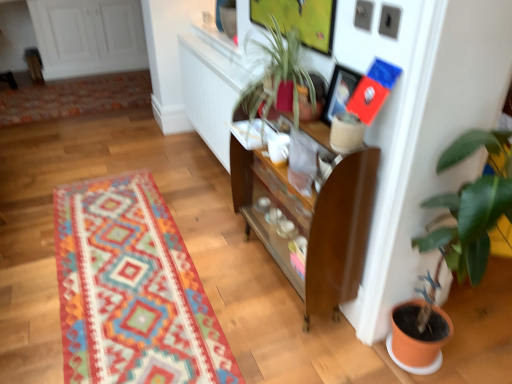
Question: Is white glossy coffee cup at center positioned beyond the bounds of multicolored woven rug at upper left, placed as the first mat when sorted from back to front?

Choices:
 (A) yes
 (B) no

Answer: (A)

Question: From a real-world perspective, is white glossy coffee cup at center located beneath multicolored woven rug at upper left, which is the 1th mat in top-to-bottom order?

Choices:
 (A) no
 (B) yes

Answer: (A)

Question: Is white glossy coffee cup at center positioned in front of multicolored woven rug at upper left, the 2th mat in the front-to-back sequence?

Choices:
 (A) no
 (B) yes

Answer: (B)

Question: Does white glossy coffee cup at center have a larger size compared to multicolored woven rug at upper left, marked as the 2th mat in a bottom-to-top arrangement?

Choices:
 (A) yes
 (B) no

Answer: (B)

Question: Is white glossy coffee cup at center positioned with its back to multicolored woven rug at upper left, which is the 1th mat in top-to-bottom order?

Choices:
 (A) yes
 (B) no

Answer: (B)

Question: In terms of height, does white glossy coffee cup at center look taller or shorter compared to brown wood cabinet at center?

Choices:
 (A) tall
 (B) short

Answer: (B)

Question: From a real-world perspective, is white glossy coffee cup at center above or below brown wood cabinet at center?

Choices:
 (A) below
 (B) above

Answer: (B)

Question: Considering the relative positions of white glossy coffee cup at center and brown wood cabinet at center in the image provided, is white glossy coffee cup at center to the left or to the right of brown wood cabinet at center?

Choices:
 (A) left
 (B) right

Answer: (A)

Question: Is point (287, 145) closer or farther from the camera than point (352, 261)?

Choices:
 (A) closer
 (B) farther

Answer: (B)

Question: Do you think brown wood cabinet at center is within multicolored woven rug at upper left, marked as the 2th mat in a bottom-to-top arrangement, or outside of it?

Choices:
 (A) outside
 (B) inside

Answer: (A)

Question: Is brown wood cabinet at center taller or shorter than multicolored woven rug at upper left, marked as the 2th mat in a bottom-to-top arrangement?

Choices:
 (A) short
 (B) tall

Answer: (B)

Question: In terms of width, does brown wood cabinet at center look wider or thinner when compared to multicolored woven rug at upper left, marked as the 2th mat in a bottom-to-top arrangement?

Choices:
 (A) wide
 (B) thin

Answer: (B)

Question: Is point (362, 230) positioned closer to the camera than point (38, 100)?

Choices:
 (A) closer
 (B) farther

Answer: (A)

Question: From the image's perspective, is green glossy plant at right located above or below multicolored woven rug at center, which appears as the second mat when viewed from the back?

Choices:
 (A) above
 (B) below

Answer: (A)

Question: Is point (418, 238) positioned closer to the camera than point (78, 297)?

Choices:
 (A) closer
 (B) farther

Answer: (A)